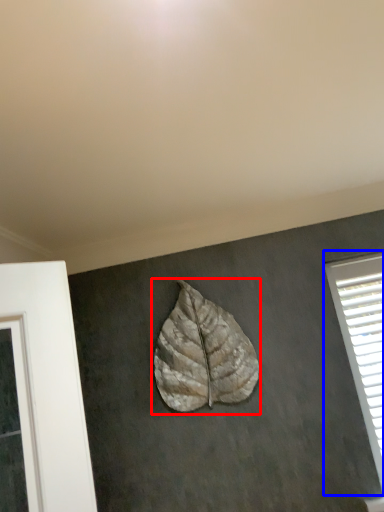
Question: Which of the following is the closest to the observer, leaf (highlighted by a red box) or window (highlighted by a blue box)?

Choices:
 (A) leaf
 (B) window

Answer: (A)